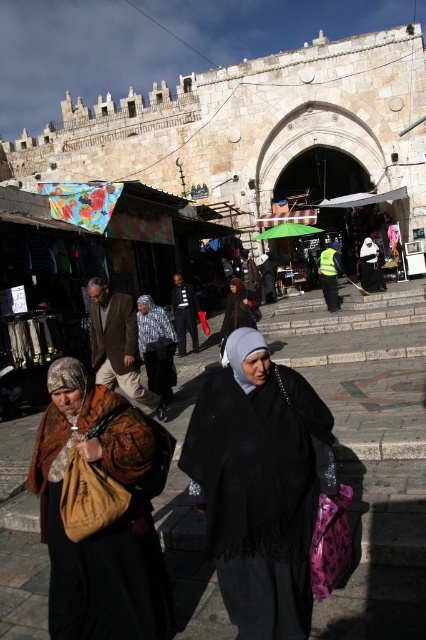
In the scene shown: You are standing at the entrance of the marketplace and want to take a photo that includes both the historic archway and the people in the foreground. Which of the two points, point (215, 381) or point (253, 314), is closer to you and should be prioritized in your composition to ensure they are in focus?

Point (215, 381) is closer to the camera than point (253, 314), so it should be prioritized in your composition to ensure it is in focus.

You are a traveler carrying a dark gray knit hat at center and a brown textured fabric bag at lower left. You want to place both items side by side on a narrow shelf. Which item should you place first to ensure both fit?

The dark gray knit hat at center should be placed first because the brown textured fabric bag at lower left is wider and needs more space. Since the bag is wider, placing the narrower hat first allows the bag to fit next to it on the shelf.

Looking at this image, you are a traveler carrying a black woolen shawl at center and a brown textured fabric bag at lower left. You want to hang both items on a hook. Which item should you hang first to avoid the bag touching the ground?

The black woolen shawl at center is taller than the brown textured fabric bag at lower left. Therefore, you should hang the black woolen shawl at center first to ensure the bag does not touch the ground.